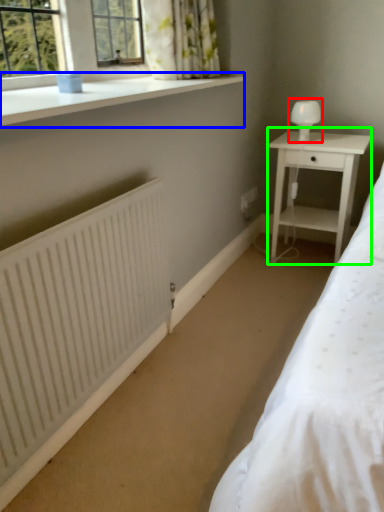
Question: Estimate the real-world distances between objects in this image. Which object is farther from table lamp (highlighted by a red box), window sill (highlighted by a blue box) or nightstand (highlighted by a green box)?

Choices:
 (A) window sill
 (B) nightstand

Answer: (A)